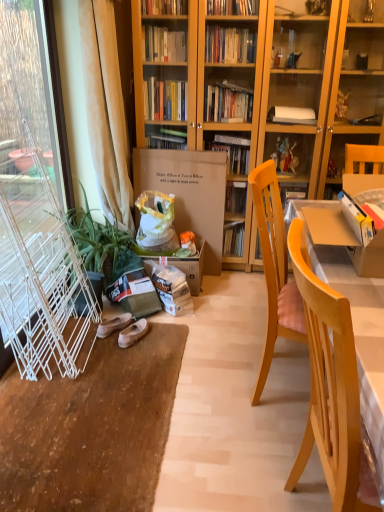
The height and width of the screenshot is (512, 384). I want to click on white leather ballet flats at lower left, which is counted as the 1th footwear, starting from the right, so click(x=132, y=333).

Describe the element at coordinates (114, 325) in the screenshot. I see `white fabric slipper at lower left, the 2th footwear viewed from the right` at that location.

Where is `white fabric slipper at lower left, the 2th footwear viewed from the right`? This screenshot has width=384, height=512. white fabric slipper at lower left, the 2th footwear viewed from the right is located at coordinates (114, 325).

What do you see at coordinates (188, 193) in the screenshot?
I see `brown cardboard box at center` at bounding box center [188, 193].

Identify the location of white wire screen door at left. Image resolution: width=384 pixels, height=512 pixels. (36, 215).

The width and height of the screenshot is (384, 512). What are the coordinates of `beige fabric curtain at left` in the screenshot? It's located at [106, 111].

Between point (105, 234) and point (352, 348), which one is positioned in front?

The point (352, 348) is closer.

Is light wood chair at right inside green leafy plant at left?

No, green leafy plant at left does not contain light wood chair at right.

Can you confirm if green leafy plant at left is taller than light wood chair at right?

Indeed, green leafy plant at left has a greater height compared to light wood chair at right.

From a real-world perspective, is green leafy plant at left above or below light wood chair at right?

green leafy plant at left is above light wood chair at right.

Looking at the image, does green leafy plant at left seem bigger or smaller compared to white leather ballet flats at lower left, the second footwear positioned from the left?

Considering their sizes, green leafy plant at left takes up more space than white leather ballet flats at lower left, the second footwear positioned from the left.

Is green leafy plant at left aimed at white leather ballet flats at lower left, the second footwear positioned from the left?

No, green leafy plant at left is not aimed at white leather ballet flats at lower left, the second footwear positioned from the left.

Which object is positioned more to the right, white leather ballet flats at lower left, the second footwear positioned from the left, or green leafy plant at left?

Positioned to the right is white leather ballet flats at lower left, the second footwear positioned from the left.

Considering the relative sizes of white leather ballet flats at lower left, which is counted as the 1th footwear, starting from the right, and green leafy plant at left in the image provided, is white leather ballet flats at lower left, which is counted as the 1th footwear, starting from the right, wider than green leafy plant at left?

In fact, white leather ballet flats at lower left, which is counted as the 1th footwear, starting from the right, might be narrower than green leafy plant at left.

From the image's perspective, which is above, white leather ballet flats at lower left, the second footwear positioned from the left, or green leafy plant at left?

green leafy plant at left.

Considering the sizes of objects white leather ballet flats at lower left, the second footwear positioned from the left, and green leafy plant at left in the image provided, who is taller, white leather ballet flats at lower left, the second footwear positioned from the left, or green leafy plant at left?

Standing taller between the two is green leafy plant at left.

From the image's perspective, does white leather ballet flats at lower left, which is counted as the 1th footwear, starting from the right, appear lower than white wire screen door at left?

Yes, from the image's perspective, white leather ballet flats at lower left, which is counted as the 1th footwear, starting from the right, is beneath white wire screen door at left.

From a real-world perspective, does white leather ballet flats at lower left, the second footwear positioned from the left, sit lower than white wire screen door at left?

Yes, from a real-world perspective, white leather ballet flats at lower left, the second footwear positioned from the left, is under white wire screen door at left.

Between point (141, 328) and point (49, 154), which one is positioned behind?

The point (141, 328) is more distant.

In the scene shown: Can you confirm if white leather ballet flats at lower left, the second footwear positioned from the left, is positioned to the right of white wire screen door at left?

Yes, white leather ballet flats at lower left, the second footwear positioned from the left, is to the right of white wire screen door at left.

Is beige fabric curtain at left not within light wood chair at right?

That's correct, beige fabric curtain at left is outside of light wood chair at right.

Is beige fabric curtain at left turned away from light wood chair at right?

That's not correct — beige fabric curtain at left is not looking away from light wood chair at right.

From the image's perspective, between beige fabric curtain at left and light wood chair at right, who is located below?

light wood chair at right, from the image's perspective.

Locate an element on the screen. Image resolution: width=384 pixels, height=512 pixels. curtain above the light wood chair at right (from the image's perspective) is located at coordinates (106, 111).

Considering the sizes of white wire screen door at left and beige fabric curtain at left in the image, is white wire screen door at left bigger or smaller than beige fabric curtain at left?

white wire screen door at left is bigger than beige fabric curtain at left.

Image resolution: width=384 pixels, height=512 pixels. I want to click on curtain on the right of the white wire screen door at left, so click(106, 111).

Considering the positions of objects white wire screen door at left and beige fabric curtain at left in the image provided, who is in front, white wire screen door at left or beige fabric curtain at left?

white wire screen door at left is more forward.

Can you confirm if white wire screen door at left is shorter than beige fabric curtain at left?

In fact, white wire screen door at left may be taller than beige fabric curtain at left.

Consider the image. Is white wire screen door at left shorter than brown cardboard box at center?

No, white wire screen door at left is not shorter than brown cardboard box at center.

From a real-world perspective, who is located higher, white wire screen door at left or brown cardboard box at center?

white wire screen door at left is physically above.

From the image's perspective, who appears lower, white wire screen door at left or brown cardboard box at center?

brown cardboard box at center.

Is white wire screen door at left in contact with brown cardboard box at center?

white wire screen door at left and brown cardboard box at center are not in contact.

You are a GUI agent. You are given a task and a screenshot of the screen. Output one action in this format:
    pyautogui.click(x=<x>, y=<y>)
    Task: Click on the chair in front of the green leafy plant at left
    
    Given the screenshot: What is the action you would take?
    pyautogui.click(x=331, y=391)

Where is `houseplant behind the white leather ballet flats at lower left, the second footwear positioned from the left`? houseplant behind the white leather ballet flats at lower left, the second footwear positioned from the left is located at coordinates (101, 244).

From the image, which object appears to be nearer to green leafy plant at left, white leather ballet flats at lower left, which is counted as the 1th footwear, starting from the right, or brown cardboard box at center?

Among the two, brown cardboard box at center is located nearer to green leafy plant at left.

Looking at the image, which one is located closer to beige fabric curtain at left, white leather ballet flats at lower left, which is counted as the 1th footwear, starting from the right, or light wood chair at right?

white leather ballet flats at lower left, which is counted as the 1th footwear, starting from the right.

When comparing their distances from brown cardboard box at center, does green leafy plant at left or white wire screen door at left seem further?

white wire screen door at left is positioned further to the anchor brown cardboard box at center.

Looking at this image, from the image, which object appears to be nearer to green leafy plant at left, brown cardboard box at center or light wood chair at right?

Result: The object closer to green leafy plant at left is brown cardboard box at center.

Considering their positions, is green leafy plant at left positioned closer to white leather ballet flats at lower left, the second footwear positioned from the left, than light wood chair at right?

Based on the image, green leafy plant at left appears to be nearer to white leather ballet flats at lower left, the second footwear positioned from the left.

Looking at the image, which one is located further to brown cardboard box at center, white leather ballet flats at lower left, which is counted as the 1th footwear, starting from the right, or white wire screen door at left?

white leather ballet flats at lower left, which is counted as the 1th footwear, starting from the right, lies further to brown cardboard box at center than the other object.

From the image, which object appears to be nearer to beige fabric curtain at left, white leather ballet flats at lower left, the second footwear positioned from the left, or brown cardboard box at center?

brown cardboard box at center lies closer to beige fabric curtain at left than the other object.

Consider the image. When comparing their distances from white wire screen door at left, does green leafy plant at left or light wood chair at right seem further?

light wood chair at right lies further to white wire screen door at left than the other object.

Find the location of `houseplant between white wire screen door at left and brown cardboard box at center in the front-back direction`. houseplant between white wire screen door at left and brown cardboard box at center in the front-back direction is located at coordinates (101, 244).

Find the location of a particular element. The height and width of the screenshot is (512, 384). screen door between beige fabric curtain at left and white leather ballet flats at lower left, which is counted as the 1th footwear, starting from the right, in the up-down direction is located at coordinates (36, 215).

The height and width of the screenshot is (512, 384). I want to click on houseplant between white wire screen door at left and white fabric slipper at lower left, the 2th footwear viewed from the right, in the front-back direction, so 101,244.

Where is `curtain between white wire screen door at left and brown cardboard box at center from front to back`? The image size is (384, 512). curtain between white wire screen door at left and brown cardboard box at center from front to back is located at coordinates (106, 111).